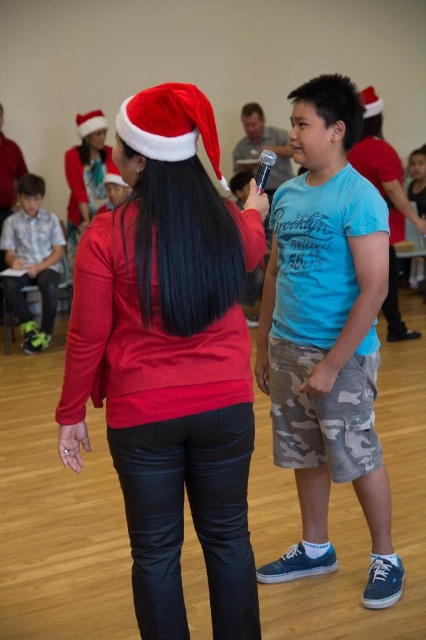
What is located at the coordinate point (327, 336) in the image?

The point at (327, 336) corresponds to camo shorts at center.

You are a photographer positioned at the back of the room. You need to take a photo that includes both the camo shorts at center and the red felt santa hat at upper left. Which object will appear closer to the camera in the photo?

The camo shorts at center will appear closer to the camera in the photo because it is further to the viewer than the red felt santa hat at upper left.

You are a photographer at the event and want to capture a photo that includes both the camo shorts at center and the red felt santa hat at upper left. Which object should you focus on first to ensure both are in frame?

The camo shorts at center is located below the red felt santa hat at upper left, so you should focus on the red felt santa hat at upper left first to ensure both are in frame.